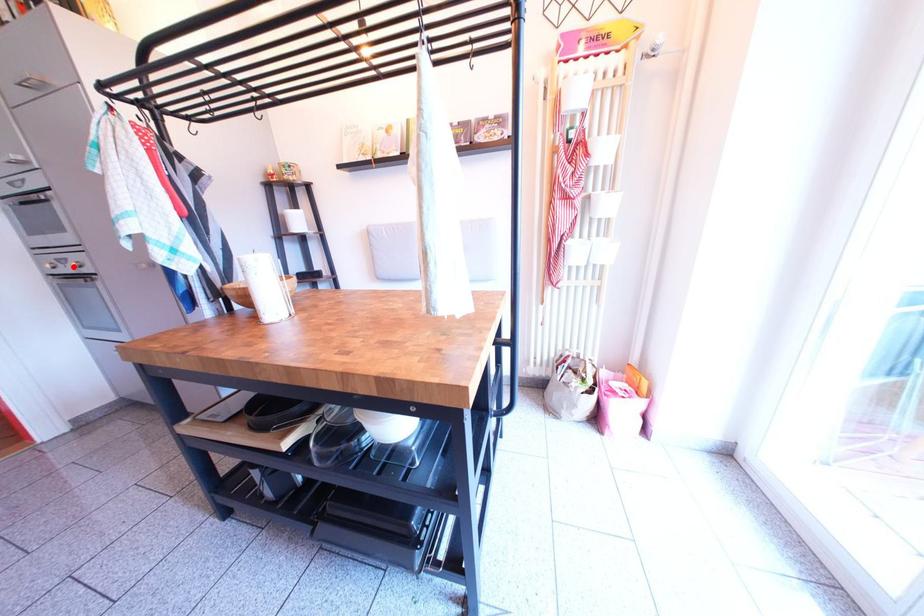
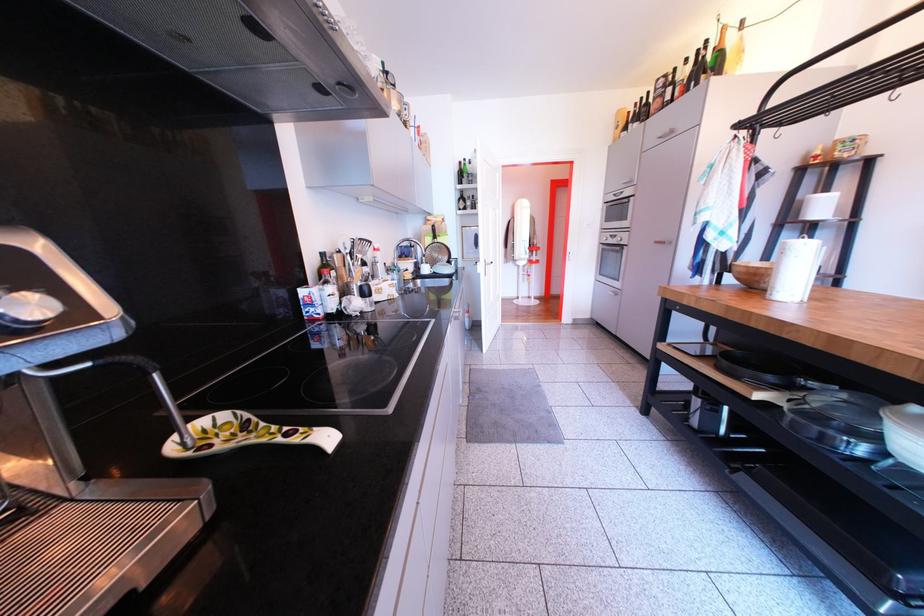
Question: A red point is marked in image1. In image2, is the corresponding 3D point closer to the camera or farther? Reply with the corresponding letter.

Choices:
 (A) The corresponding 3D point is closer.
 (B) The corresponding 3D point is farther.

Answer: (A)